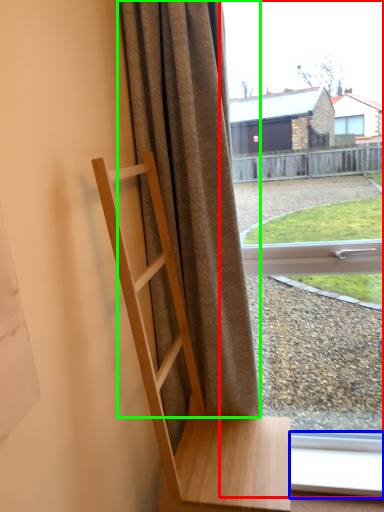
Question: Considering the real-world distances, which object is closest to window (highlighted by a red box)? window frame (highlighted by a blue box) or curtain (highlighted by a green box).

Choices:
 (A) window frame
 (B) curtain

Answer: (B)